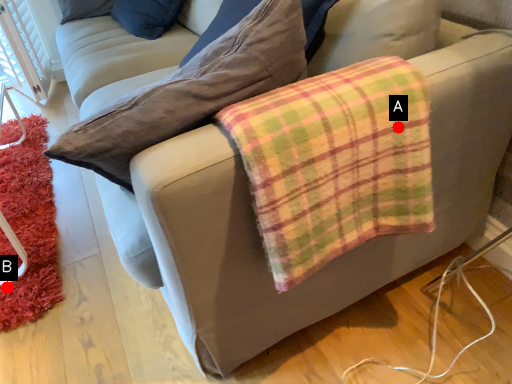
Question: Two points are circled on the image, labeled by A and B beside each circle. Which point appears closest to the camera in this image?

Choices:
 (A) A is closer
 (B) B is closer

Answer: (A)